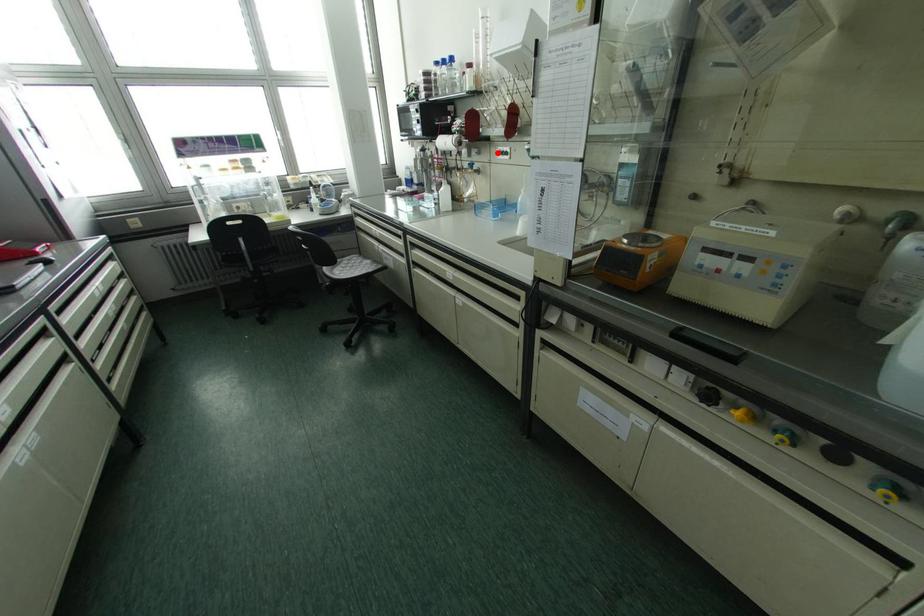
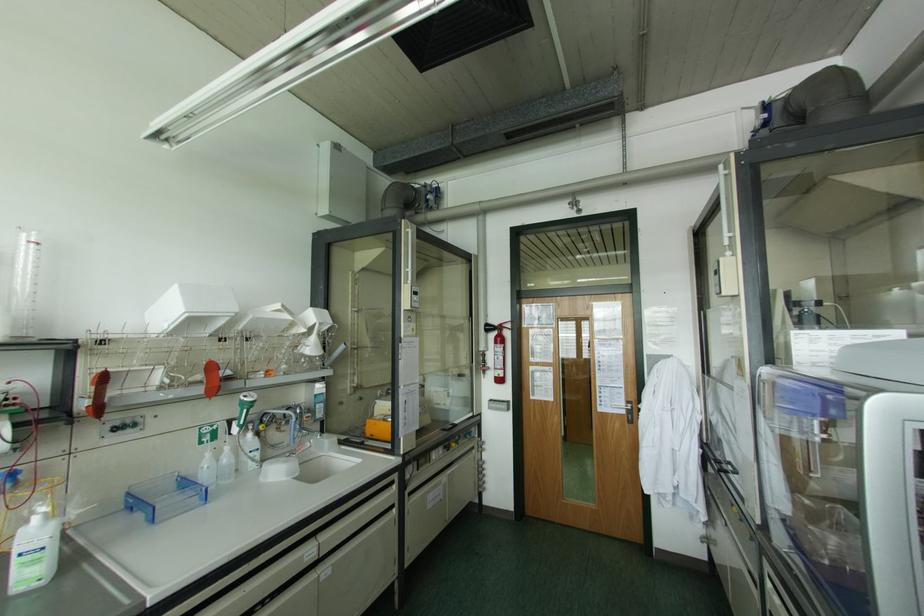
Question: A red point is marked in image1. In image2, is the corresponding 3D point closer to the camera or farther? Reply with the corresponding letter.

Choices:
 (A) The corresponding 3D point is closer.
 (B) The corresponding 3D point is farther.

Answer: (B)